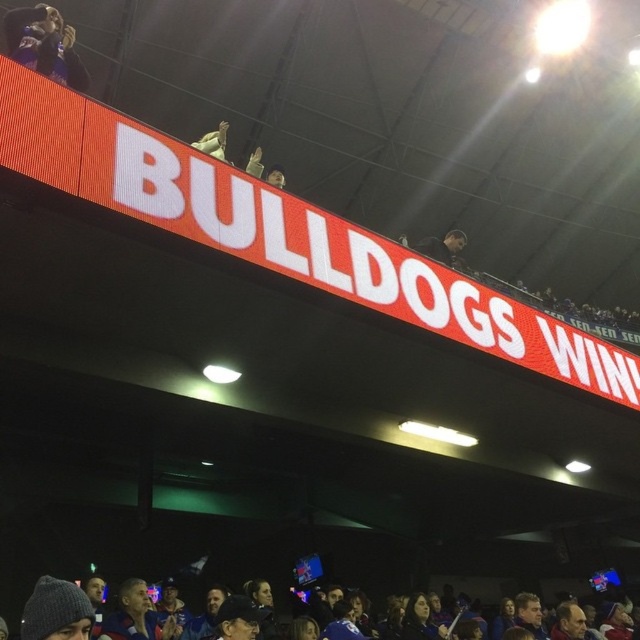
Can you confirm if dark gray fabric jacket at upper center is thinner than dark gray hoodie at center?

No.

Identify the location of dark gray fabric jacket at upper center. Image resolution: width=640 pixels, height=640 pixels. (444, 246).

Find the location of a particular element. The width and height of the screenshot is (640, 640). dark gray fabric jacket at upper center is located at coordinates (444, 246).

Who is more forward, (10,32) or (28,602)?

Positioned in front is point (28,602).

Looking at this image, is dark fabric hoodie at upper left bigger than gray knit cap at lower left?

No.

Identify the location of dark fabric hoodie at upper left. The width and height of the screenshot is (640, 640). (44, 44).

The height and width of the screenshot is (640, 640). In order to click on dark fabric hoodie at upper left in this screenshot , I will do `click(44, 44)`.

Which is behind, point (13, 52) or point (253, 154)?

Point (253, 154)

Does dark fabric hoodie at upper left have a lesser height compared to dark gray hoodie at center?

No, dark fabric hoodie at upper left is not shorter than dark gray hoodie at center.

This screenshot has height=640, width=640. What do you see at coordinates (44, 44) in the screenshot? I see `dark fabric hoodie at upper left` at bounding box center [44, 44].

Where is `dark fabric hoodie at upper left`? The image size is (640, 640). dark fabric hoodie at upper left is located at coordinates (44, 44).